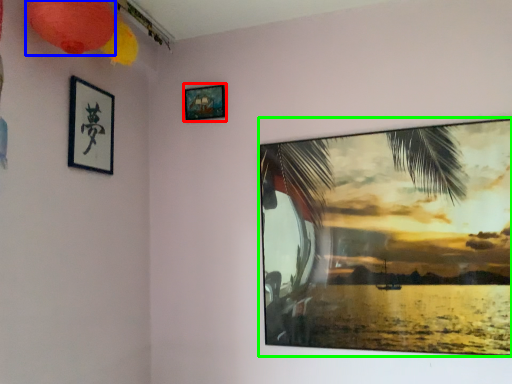
Question: Which object is positioned farthest from picture frame (highlighted by a red box)? Select from lantern (highlighted by a blue box) and picture frame (highlighted by a green box).

Choices:
 (A) lantern
 (B) picture frame

Answer: (B)